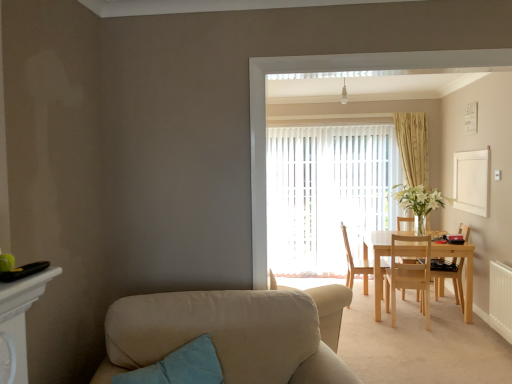
The image size is (512, 384). I want to click on vacant area that lies between light wood chair at center, arranged as the 2th chair when viewed from the right, and light wood table at center, so click(439, 324).